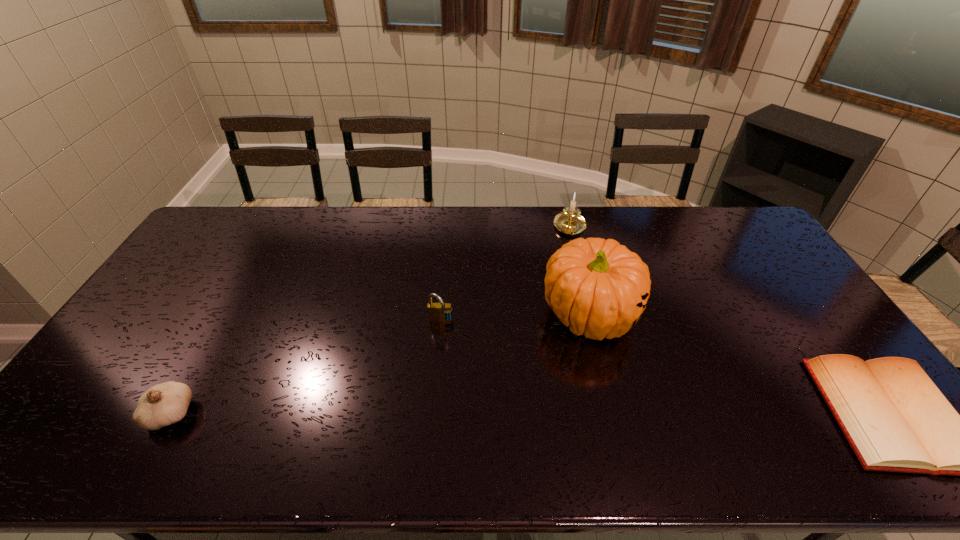
Locate an element on the screen. vacant space at the right edge of the desktop is located at coordinates (754, 246).

Locate an element on the screen. vacant space at the far left corner is located at coordinates (212, 239).

Identify the location of free area in between the tallest object and the padlock. The width and height of the screenshot is (960, 540). (516, 319).

The image size is (960, 540). What are the coordinates of `vacant region between the leftmost object and the tallest object` in the screenshot? It's located at coord(381,364).

I want to click on empty location between the padlock and the pumpkin, so click(516, 319).

Identify the location of blank region between the second object from left to right and the leftmost object. The width and height of the screenshot is (960, 540). (306, 368).

Locate an element on the screen. The image size is (960, 540). free space that is in between the second tallest object and the leftmost object is located at coordinates (371, 321).

Find the location of `object that is the fourth nearest to the pumpkin`. object that is the fourth nearest to the pumpkin is located at coordinates (164, 404).

Locate an element on the screen. object that is the second closest to the second tallest object is located at coordinates (437, 312).

This screenshot has height=540, width=960. I want to click on vacant area that satisfies the following two spatial constraints: 1. on the back side of the leftmost object; 2. on the right side of the farthest object, so click(x=276, y=227).